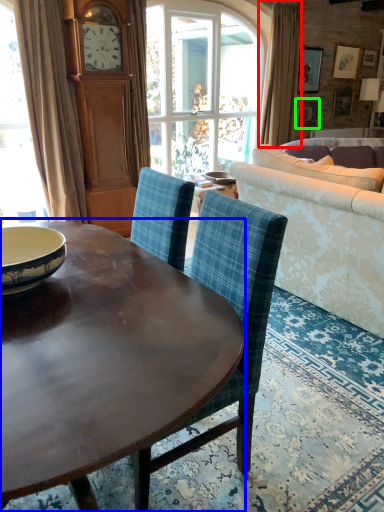
Question: Which is nearer to the curtain (highlighted by a red box)? coffee table (highlighted by a blue box) or picture frame (highlighted by a green box).

Choices:
 (A) coffee table
 (B) picture frame

Answer: (B)